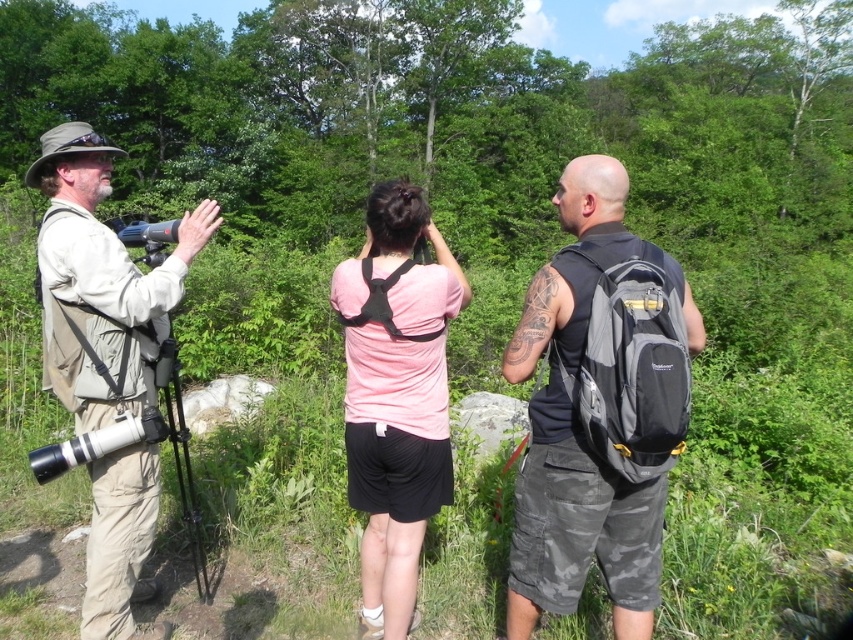
Question: Does khaki fabric shirt at left come behind pink fabric shirt at center?

Choices:
 (A) yes
 (B) no

Answer: (B)

Question: Is khaki fabric shirt at left wider than black metal tripod at left?

Choices:
 (A) yes
 (B) no

Answer: (B)

Question: Is khaki fabric shirt at left closer to the viewer compared to black fabric backpack at center?

Choices:
 (A) yes
 (B) no

Answer: (A)

Question: Which object is farther from the camera taking this photo?

Choices:
 (A) khaki fabric shirt at left
 (B) pink fabric shirt at center
 (C) black metal tripod at left
 (D) black fabric backpack at center

Answer: (C)

Question: Estimate the real-world distances between objects in this image. Which object is closer to the black metal tripod at left?

Choices:
 (A) khaki fabric shirt at left
 (B) black fabric backpack at center

Answer: (A)

Question: Among these objects, which one is nearest to the camera?

Choices:
 (A) khaki fabric shirt at left
 (B) pink fabric shirt at center
 (C) black fabric backpack at center

Answer: (A)